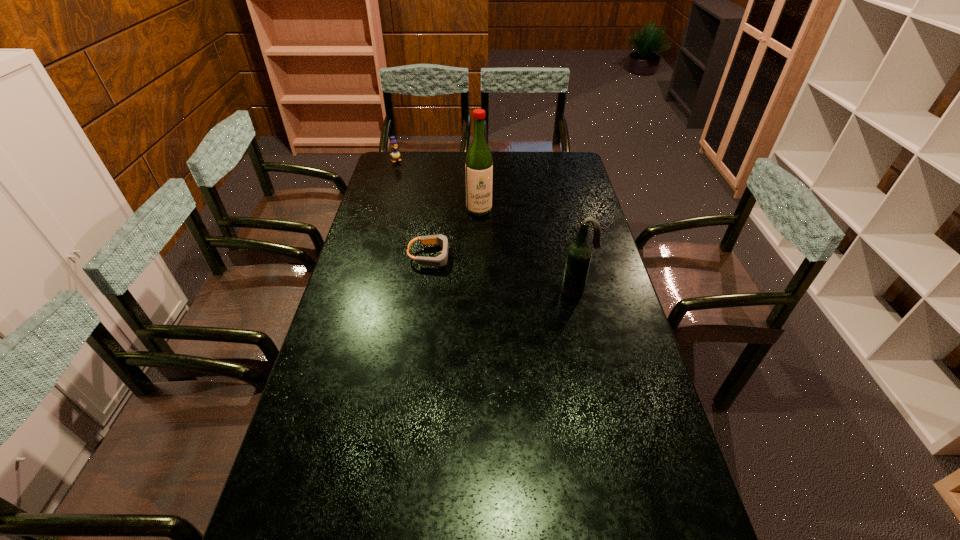
Where is `free spot on the desktop that is between the second object from left to right and the rightmost object and is positioned on the label of the tallest object`? free spot on the desktop that is between the second object from left to right and the rightmost object and is positioned on the label of the tallest object is located at coordinates (498, 273).

What are the coordinates of `vacant spot on the desktop that is between the goggles and the nearest object and is positioned on the face of the farthest object, where the monocle is placed` in the screenshot? It's located at (499, 273).